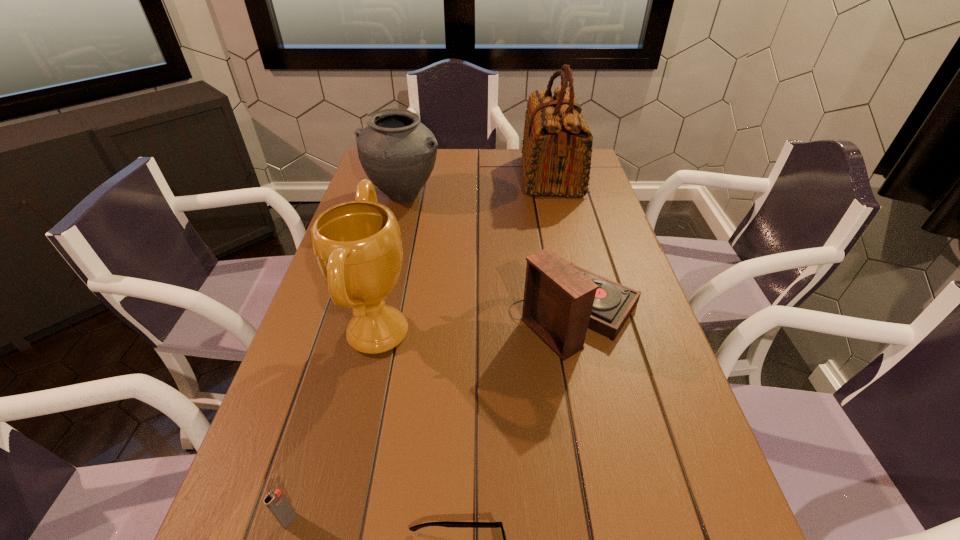
Image resolution: width=960 pixels, height=540 pixels. Identify the location of vacant position in the image that satisfies the following two spatial constraints: 1. on the front of the award with the decoration; 2. on the front side of the fifth farthest object. (336, 520).

The image size is (960, 540). I want to click on free spot that satisfies the following two spatial constraints: 1. on the back side of the fourth tallest object; 2. on the right side of the igniter, so click(350, 313).